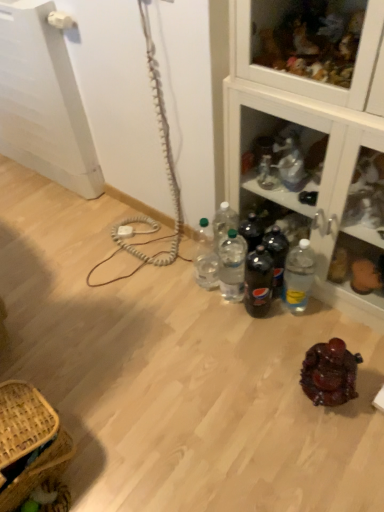
Find the location of a particular element. vacant region to the left of translucent plastic soda bottles at center, the fourth bottle from the left is located at coordinates (223, 313).